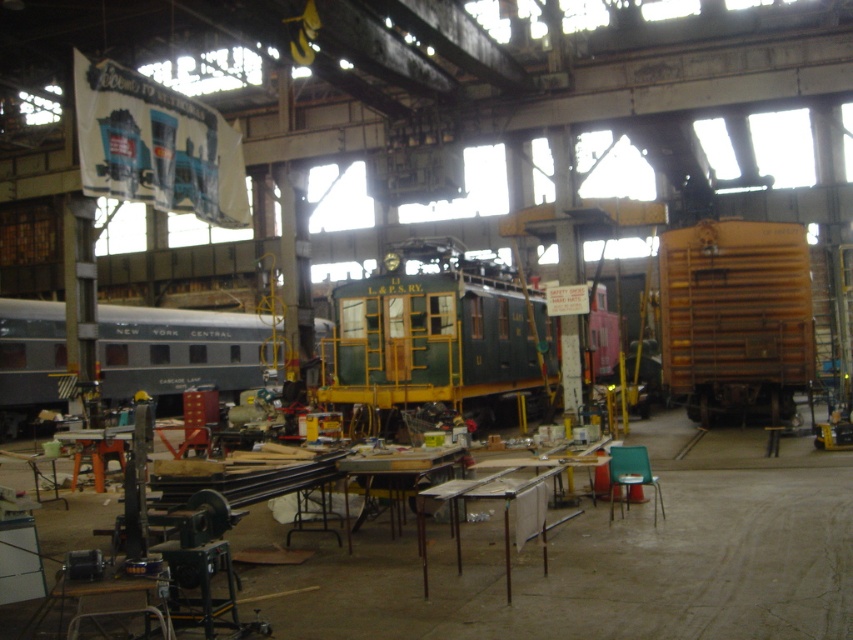
You are an inspector checking the clearance height in the train workshop. The green matte train car at center and the rustic wood grain train car at right are both in the same area. Which one requires more vertical clearance due to its height?

The green matte train car at center requires more vertical clearance because it has a greater height compared to the rustic wood grain train car at right.

You are a train conductor who needs to load a cargo container that is 12 feet wide onto either the green matte train car at center or the silver polished metal train car at left. Based on their widths, which train car would be suitable for the cargo container?

The green matte train car at center might be wider than silver polished metal train car at left, so it is more likely to accommodate the 12 feet wide cargo container.